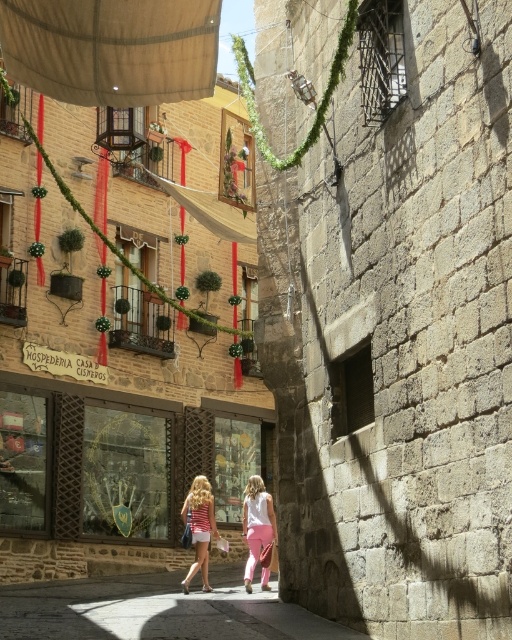
You are a tourist walking down the historic street and notice two items of clothing at the center of the scene. Which one is closer to you, the matte pink pants at center or the striped fabric dress at center?

The matte pink pants at center is in front of striped fabric dress at center, so the matte pink pants at center is closer to you.